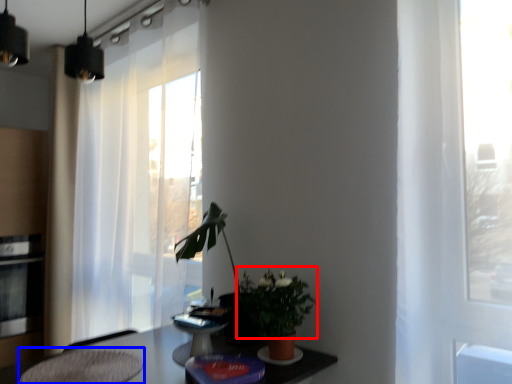
Question: Which object is further to the camera taking this photo, floral arrangement (highlighted by a red box) or swivel chair (highlighted by a blue box)?

Choices:
 (A) floral arrangement
 (B) swivel chair

Answer: (A)